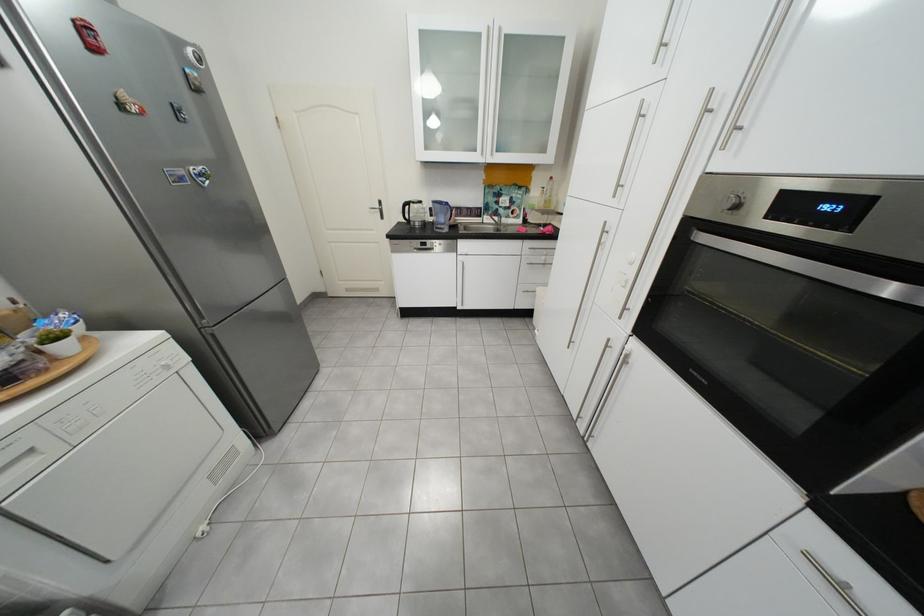
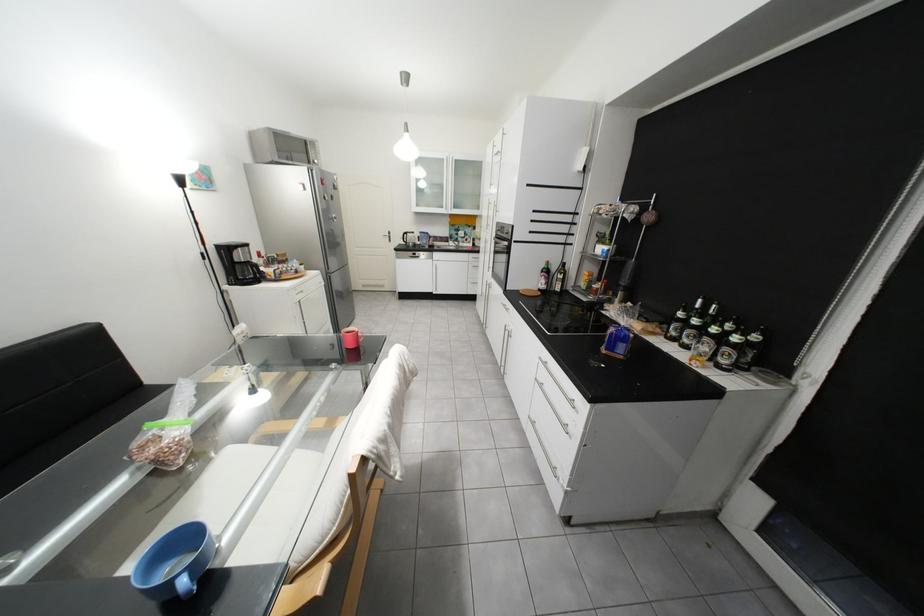
Question: What movement of the cameraman would produce the second image?

Choices:
 (A) Left
 (B) Right
 (C) Forward
 (D) Backward

Answer: (D)